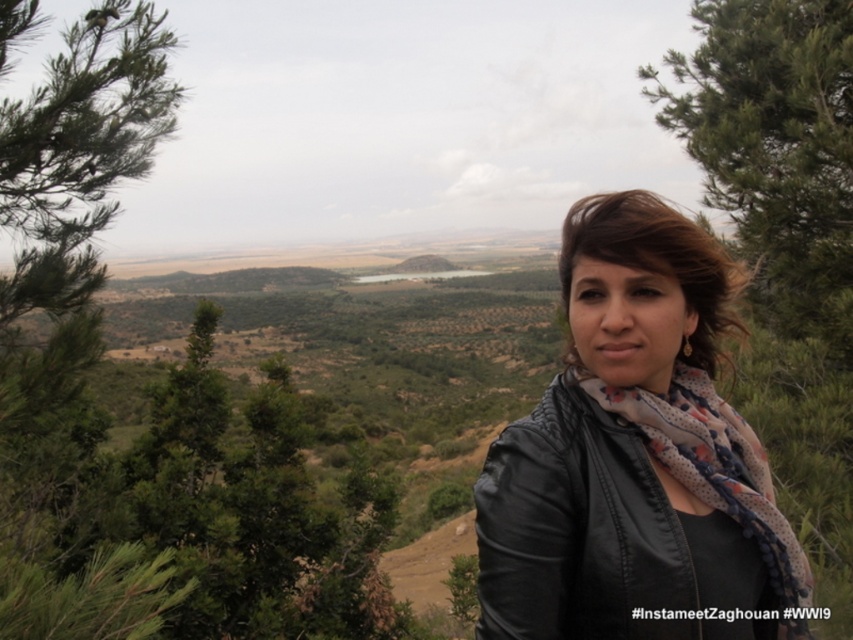
You are a photographer trying to capture the woman in the matte black jacket at center and the green leafy tree at upper right in the same frame. Based on their sizes in the image, which object would appear smaller in the photo?

The matte black jacket at center appears smaller in the photo because it has a lesser width compared to the green leafy tree at upper right.